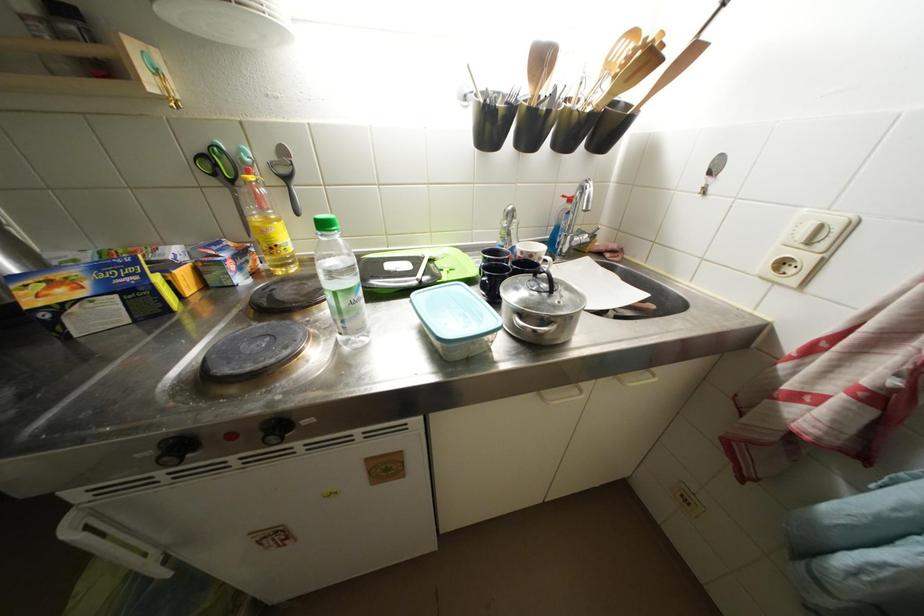
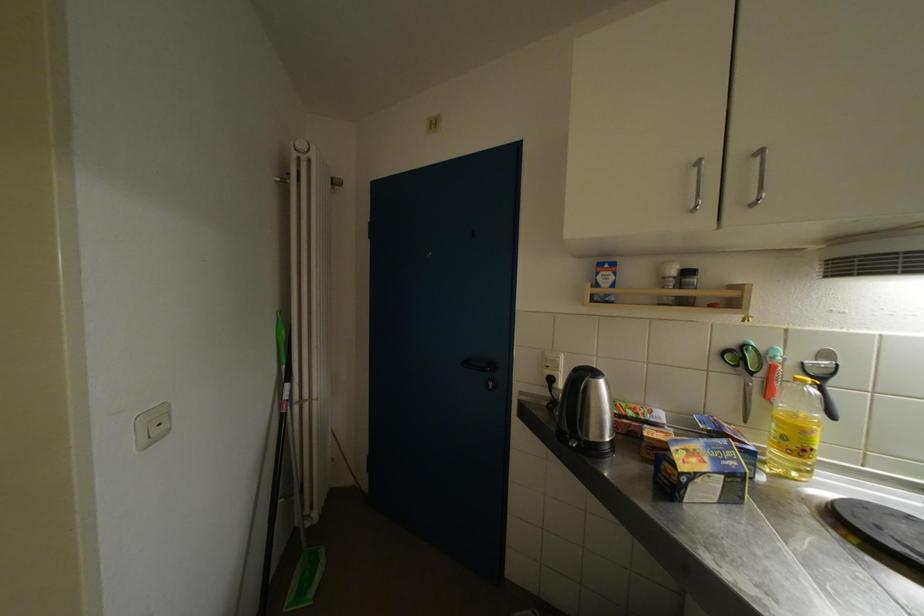
The images are taken continuously from a first-person perspective. In which direction is your viewpoint rotating?

The camera's rotation is toward left-up.